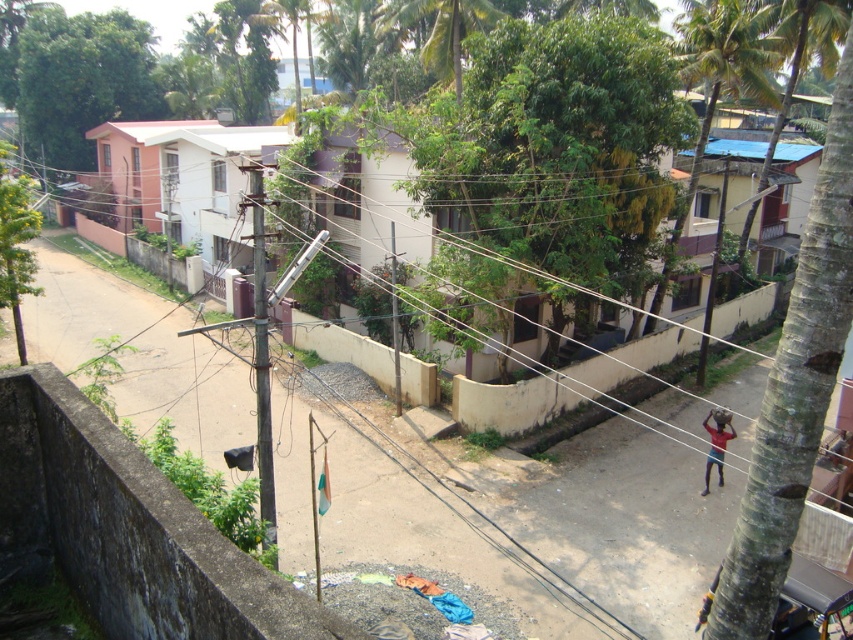
Question: Can you confirm if green rough bark tree at right is positioned above green leafy tree at upper left?

Choices:
 (A) yes
 (B) no

Answer: (B)

Question: Can you confirm if green rough bark tree at right is wider than green leafy tree at left?

Choices:
 (A) yes
 (B) no

Answer: (A)

Question: Which object is positioned farthest from the green leafy palm tree at upper right?

Choices:
 (A) green leafy tree at upper left
 (B) green rough bark tree at right
 (C) green leafy tree at left

Answer: (A)

Question: Observing the image, what is the correct spatial positioning of green rough bark tree at right in reference to green leafy tree at upper left?

Choices:
 (A) above
 (B) below

Answer: (B)

Question: Based on their relative distances, which object is nearer to the green rough bark tree at right?

Choices:
 (A) green leafy tree at left
 (B) green leafy palm tree at upper right

Answer: (B)

Question: Based on their relative distances, which object is nearer to the green leafy palm tree at upper right?

Choices:
 (A) green leafy tree at upper left
 (B) green leafy tree at left
 (C) green rough bark tree at right

Answer: (C)